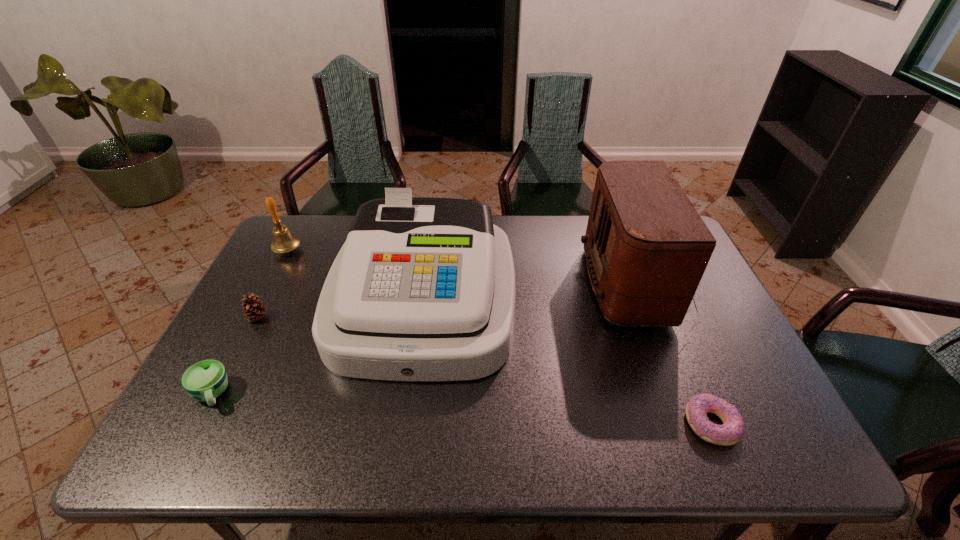
This screenshot has width=960, height=540. I want to click on cup that is at the left edge, so click(205, 380).

Find the location of `radio receiver positioned at the right edge`. radio receiver positioned at the right edge is located at coordinates (647, 248).

Where is `doughnut that is at the right edge`? This screenshot has height=540, width=960. doughnut that is at the right edge is located at coordinates (733, 428).

Where is `object located in the far left corner section of the desktop`? The height and width of the screenshot is (540, 960). object located in the far left corner section of the desktop is located at coordinates (284, 241).

You are a GUI agent. You are given a task and a screenshot of the screen. Output one action in this format:
    pyautogui.click(x=<x>, y=<y>)
    Task: Click on the object that is positioned at the far right corner
    The height and width of the screenshot is (540, 960).
    Given the screenshot: What is the action you would take?
    pyautogui.click(x=647, y=248)

In order to click on object that is at the near right corner in this screenshot , I will do `click(733, 428)`.

In the image, there is a desktop. In order to click on vacant space at the far edge in this screenshot , I will do `click(330, 240)`.

In order to click on free region at the near edge of the desktop in this screenshot , I will do `click(250, 448)`.

In the image, there is a desktop. Where is `vacant space at the left edge`? The image size is (960, 540). vacant space at the left edge is located at coordinates (265, 319).

In the image, there is a desktop. Where is `vacant space at the right edge`? This screenshot has width=960, height=540. vacant space at the right edge is located at coordinates (678, 339).